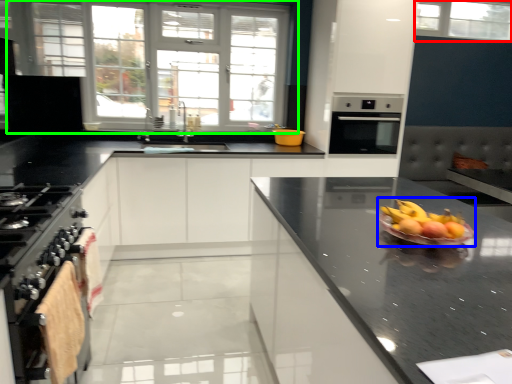
Question: Estimate the real-world distances between objects in this image. Which object is farther from window (highlighted by a red box), fruit salad (highlighted by a blue box) or window (highlighted by a green box)?

Choices:
 (A) fruit salad
 (B) window

Answer: (A)